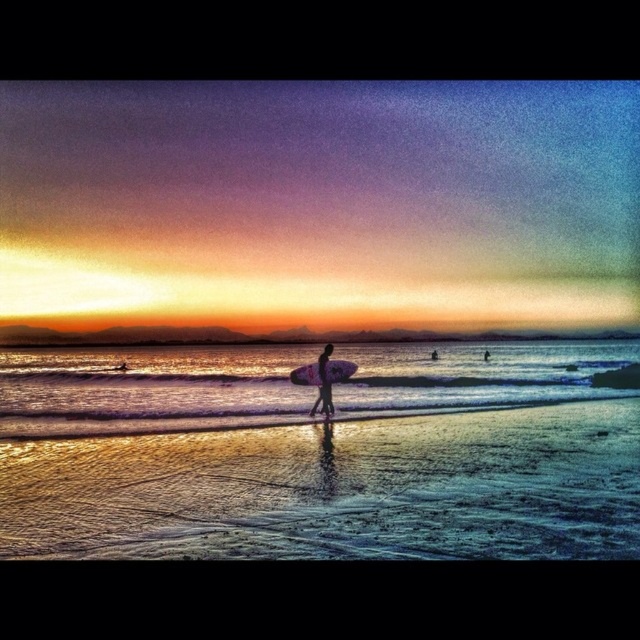
Question: Is sandy beach at center wider than white foam surfboard at center?

Choices:
 (A) no
 (B) yes

Answer: (B)

Question: Which point is closer to the camera?

Choices:
 (A) white foam surfboard at center
 (B) sandy beach at center
 (C) shiny silver water at center
 (D) silhouette surfboard at center

Answer: (B)

Question: Among these points, which one is farthest from the camera?

Choices:
 (A) (196, 492)
 (B) (339, 378)

Answer: (B)

Question: Can you confirm if sandy beach at center is positioned above shiny silver water at center?

Choices:
 (A) yes
 (B) no

Answer: (A)

Question: Which of the following is the farthest from the observer?

Choices:
 (A) (468, 504)
 (B) (317, 356)
 (C) (563, 362)
 (D) (317, 378)

Answer: (C)

Question: Is sandy beach at center bigger than silhouette surfboard at center?

Choices:
 (A) yes
 (B) no

Answer: (A)